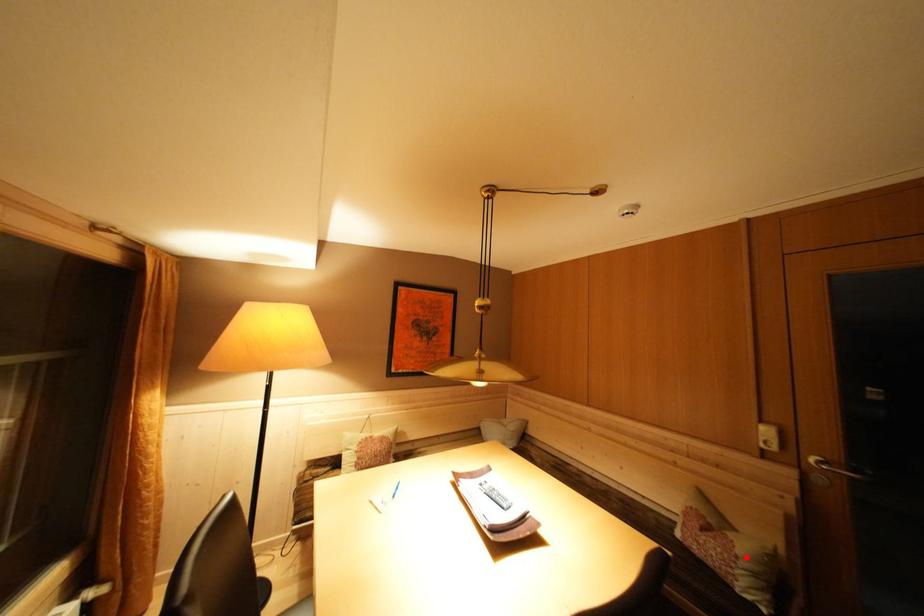
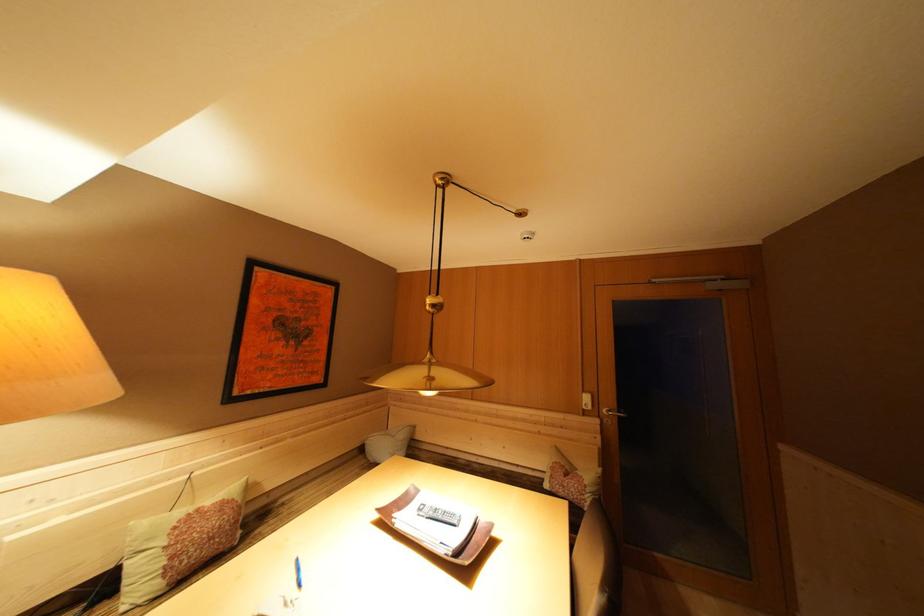
Locate, in the second image, the point that corresponds to the highlighted location in the first image.

(592, 487)